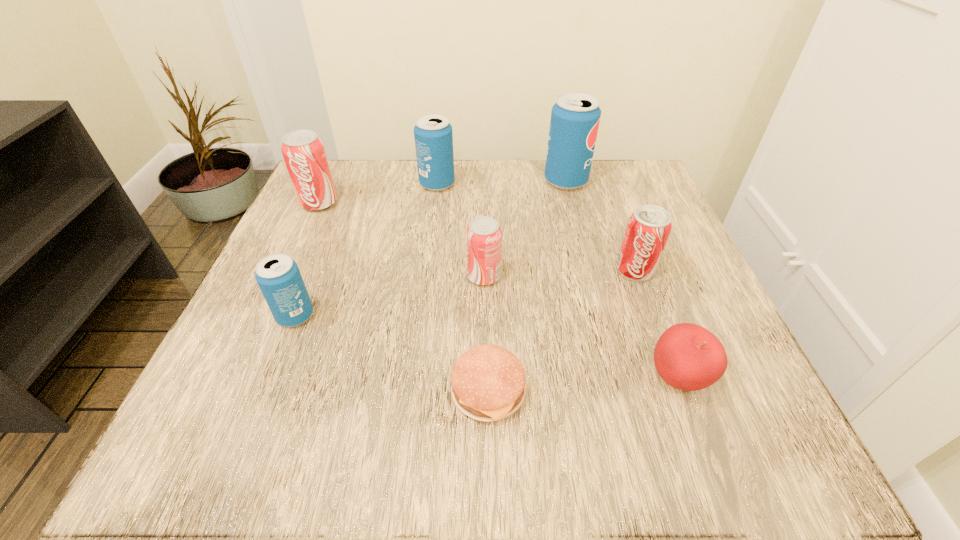
This screenshot has height=540, width=960. Identify the location of free space located on the back of the leftmost blue soda can. (346, 190).

Find the location of a particular element. The width and height of the screenshot is (960, 540). blank space located 0.070m on the left of the apple is located at coordinates (599, 379).

You are a GUI agent. You are given a task and a screenshot of the screen. Output one action in this format:
    pyautogui.click(x=<x>, y=<y>)
    Task: Click on the vacant space located 0.350m on the back of the shortest object
    
    Given the screenshot: What is the action you would take?
    [x=486, y=221]

The width and height of the screenshot is (960, 540). I want to click on apple that is positioned at the near edge, so click(687, 356).

Find the location of a particular element. hamburger situated at the near edge is located at coordinates (488, 382).

Locate an element on the screen. apple that is positioned at the right edge is located at coordinates (687, 356).

The width and height of the screenshot is (960, 540). In order to click on object that is at the far left corner in this screenshot , I will do `click(303, 151)`.

Locate an element on the screen. This screenshot has height=540, width=960. object positioned at the far right corner is located at coordinates (575, 117).

Find the location of a particular element. object that is at the near right corner is located at coordinates click(x=687, y=356).

Where is `free spot at the far edge of the desktop`? Image resolution: width=960 pixels, height=540 pixels. free spot at the far edge of the desktop is located at coordinates (514, 205).